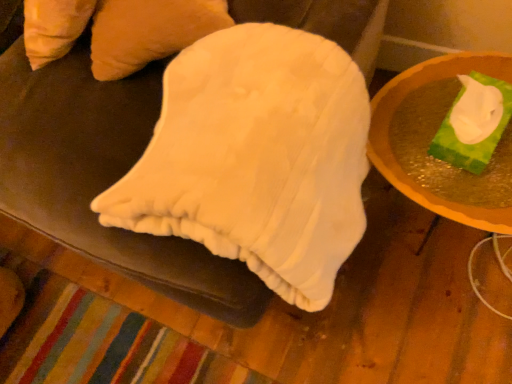
Question: From the image's perspective, relative to green matte tissue box at right, is matte white tissue box at right above or below?

Choices:
 (A) below
 (B) above

Answer: (B)

Question: Is matte white tissue box at right inside or outside of green matte tissue box at right?

Choices:
 (A) inside
 (B) outside

Answer: (B)

Question: From a real-world perspective, relative to green matte tissue box at right, is matte white tissue box at right vertically above or below?

Choices:
 (A) below
 (B) above

Answer: (A)

Question: Do you think green matte tissue box at right is within matte white tissue box at right, or outside of it?

Choices:
 (A) inside
 (B) outside

Answer: (B)

Question: From a real-world perspective, is green matte tissue box at right physically located above or below matte white tissue box at right?

Choices:
 (A) below
 (B) above

Answer: (B)

Question: Considering the positions of green matte tissue box at right and matte white tissue box at right in the image, is green matte tissue box at right wider or thinner than matte white tissue box at right?

Choices:
 (A) thin
 (B) wide

Answer: (A)

Question: Based on their sizes in the image, would you say green matte tissue box at right is bigger or smaller than matte white tissue box at right?

Choices:
 (A) big
 (B) small

Answer: (B)